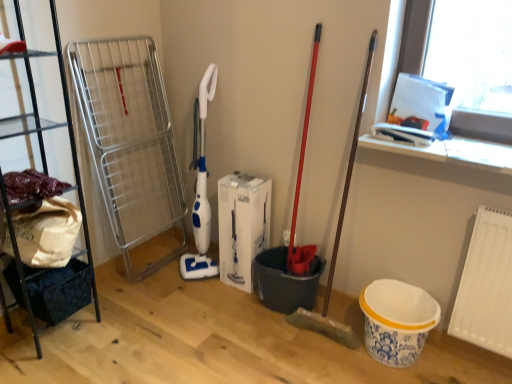
Question: Is white matte radiator at lower right to the right of dark blue fabric basket at lower left from the viewer's perspective?

Choices:
 (A) no
 (B) yes

Answer: (B)

Question: Is dark blue fabric basket at lower left located within white matte radiator at lower right?

Choices:
 (A) yes
 (B) no

Answer: (B)

Question: Is white matte radiator at lower right bigger than dark blue fabric basket at lower left?

Choices:
 (A) yes
 (B) no

Answer: (B)

Question: Does white matte radiator at lower right touch dark blue fabric basket at lower left?

Choices:
 (A) no
 (B) yes

Answer: (A)

Question: Is white matte radiator at lower right closer to the viewer compared to dark blue fabric basket at lower left?

Choices:
 (A) no
 (B) yes

Answer: (B)

Question: From the image's perspective, relative to black metal shelf at left, is dark blue fabric basket at lower left above or below?

Choices:
 (A) below
 (B) above

Answer: (A)

Question: In the image, is dark blue fabric basket at lower left positioned in front of or behind black metal shelf at left?

Choices:
 (A) front
 (B) behind

Answer: (B)

Question: From a real-world perspective, is dark blue fabric basket at lower left physically located above or below black metal shelf at left?

Choices:
 (A) above
 (B) below

Answer: (B)

Question: Choose the correct answer: Is dark blue fabric basket at lower left inside black metal shelf at left or outside it?

Choices:
 (A) inside
 (B) outside

Answer: (A)

Question: Is dark blue fabric basket at lower left spatially inside white matte radiator at lower right, or outside of it?

Choices:
 (A) inside
 (B) outside

Answer: (B)

Question: In terms of height, does dark blue fabric basket at lower left look taller or shorter compared to white matte radiator at lower right?

Choices:
 (A) tall
 (B) short

Answer: (B)

Question: Would you say dark blue fabric basket at lower left is to the left or to the right of white matte radiator at lower right in the picture?

Choices:
 (A) left
 (B) right

Answer: (A)

Question: Considering the positions of dark blue fabric basket at lower left and white matte radiator at lower right in the image, is dark blue fabric basket at lower left bigger or smaller than white matte radiator at lower right?

Choices:
 (A) small
 (B) big

Answer: (B)

Question: From their relative heights in the image, would you say white matte radiator at lower right is taller or shorter than dark blue fabric basket at lower left?

Choices:
 (A) tall
 (B) short

Answer: (A)

Question: From a real-world perspective, is white matte radiator at lower right physically located above or below dark blue fabric basket at lower left?

Choices:
 (A) above
 (B) below

Answer: (A)